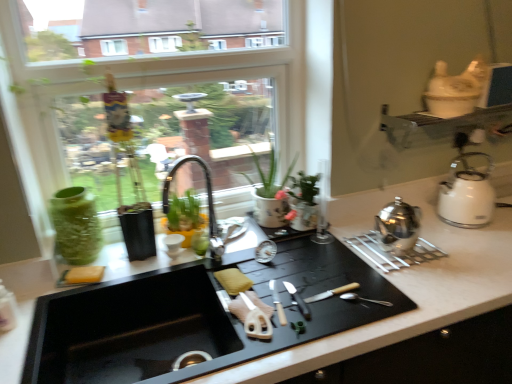
Identify the location of vacant space in front of silver metallic knife at center, marked as the first knife in a right-to-left arrangement. The image size is (512, 384). (302, 335).